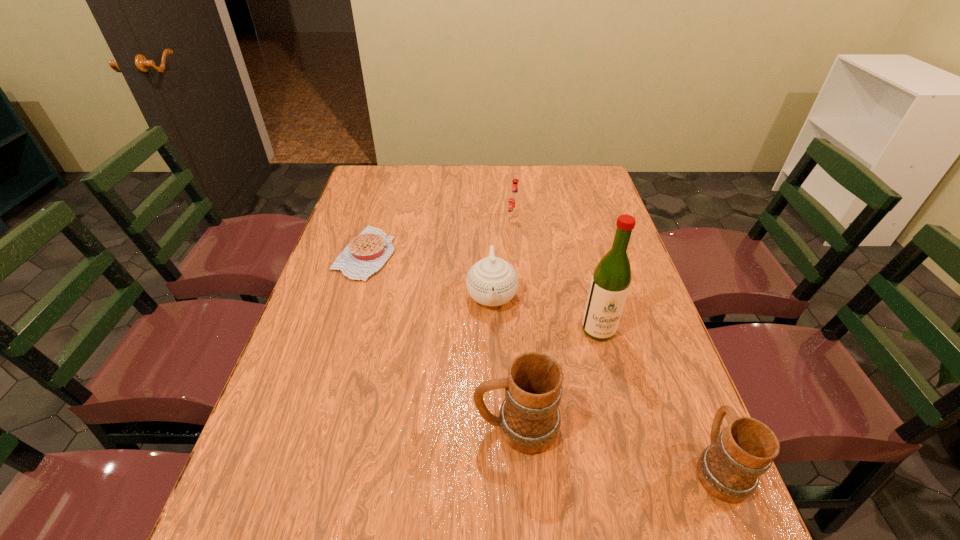
In order to click on free space that satisfies the following two spatial constraints: 1. on the side of the left mug with the handle; 2. on the side of the rightmost object with the handle in this screenshot , I will do `click(518, 467)`.